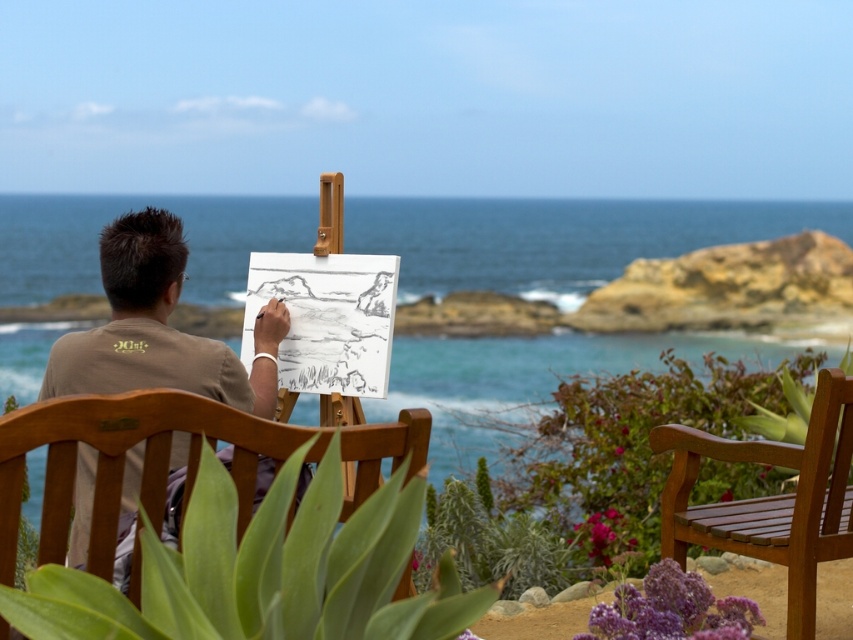
You are standing in the coastal area scene and want to take a photo of the blue water at center and brown cotton shirt at center. Which object should you focus on first to ensure both are in the same frame?

You should focus on the brown cotton shirt at center first because it is farther from the viewer than the blue water at center, allowing both to be in the same frame when focused on the farther object.

In the scene shown: You are an artist who wants to place a small sculpture exactly between the blue water at center and the teak wood bench at lower right. Which object should you position the sculpture closer to, considering their widths?

The blue water at center is wider than the teak wood bench at lower right. Therefore, the sculpture should be placed closer to the teak wood bench at lower right to balance their widths.

You are standing at the point marked as point (x=169, y=458). What object is located exactly at this point?

The wooden bench at center is located exactly at point (x=169, y=458).